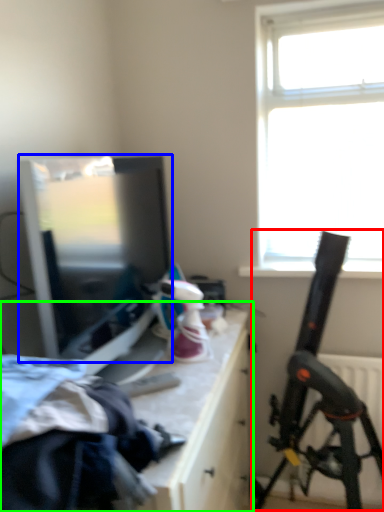
Question: Which object is the farthest from weapon (highlighted by a red box)? Choose among these: window screen (highlighted by a blue box) or table (highlighted by a green box).

Choices:
 (A) window screen
 (B) table

Answer: (A)